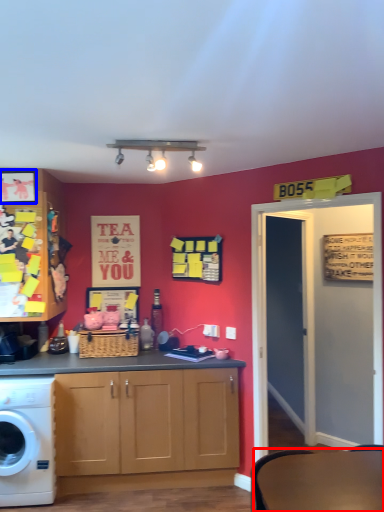
Question: Which object is closer to the camera taking this photo, round table (highlighted by a red box) or picture frame (highlighted by a blue box)?

Choices:
 (A) round table
 (B) picture frame

Answer: (A)